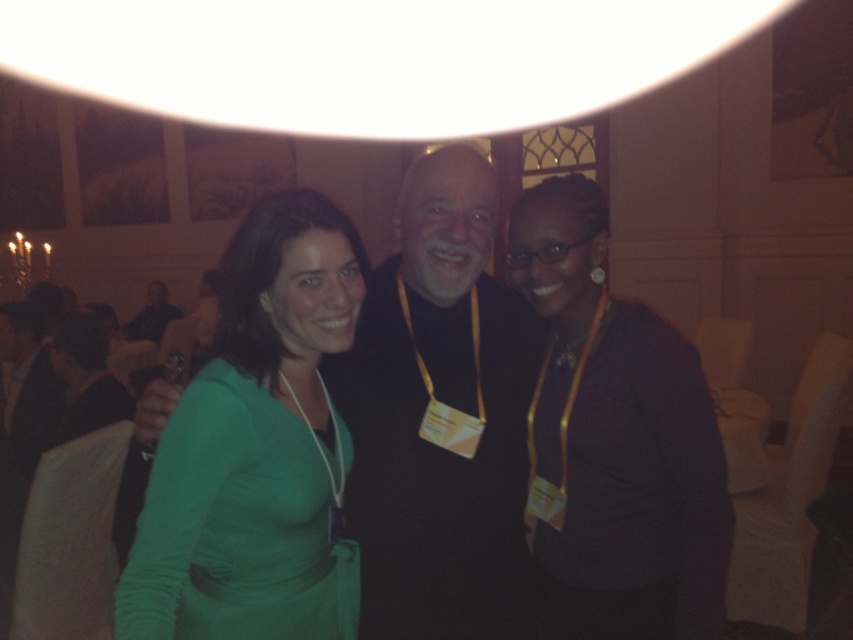
You are a photographer at the event and need to adjust the lighting so that the green matte dress at center and the black matte jacket at center are both visible. Which object should you focus on first to ensure proper exposure?

The green matte dress at center is below the black matte jacket at center. You should focus on the black matte jacket at center first because it is higher up and might be in a brighter area, ensuring both are properly exposed.

You are organizing a photo shoot and need to ensure that the green matte dress at center and the black matte jacket at center can fit side by side in a frame. Based on the scene description, can both items be placed next to each other without overlapping?

The green matte dress at center has a smaller width than the black matte jacket at center. Since the scene mentions they are positioned at the center together, it is likely they can fit side by side without overlapping, but the exact arrangement depends on the available space in the frame.

You are organizing a photo shoot and need to ensure that all clothing items are visible in the frame. Given that the green fabric dress at center and the black matte jacket at center are both at the center of the image, which clothing item requires a wider shot to fully capture its details?

The green fabric dress at center is bigger than the black matte jacket at center, so it requires a wider shot to fully capture its details.